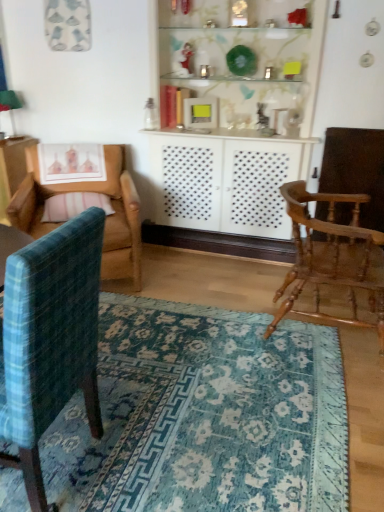
Question: In terms of width, does teal plaid chair at left, which is the second chair in right-to-left order, look wider or thinner when compared to blue woven rug at lower center?

Choices:
 (A) wide
 (B) thin

Answer: (B)

Question: Is point (92, 291) positioned closer to the camera than point (236, 346)?

Choices:
 (A) farther
 (B) closer

Answer: (B)

Question: Which of these objects is positioned farthest from the teal plaid chair at left, which is the second chair in right-to-left order?

Choices:
 (A) blue woven rug at lower center
 (B) wooden rocking chair at right, placed as the third chair when sorted from left to right
 (C) wooden armchair at left, acting as the first chair starting from the left
 (D) pink striped pillow at left

Answer: (D)

Question: Based on their relative distances, which object is farther from the teal plaid chair at left, which is the second chair in right-to-left order?

Choices:
 (A) blue woven rug at lower center
 (B) wooden armchair at left, the third chair viewed from the right
 (C) pink striped pillow at left
 (D) wooden rocking chair at right, the 1th chair positioned from the right

Answer: (C)